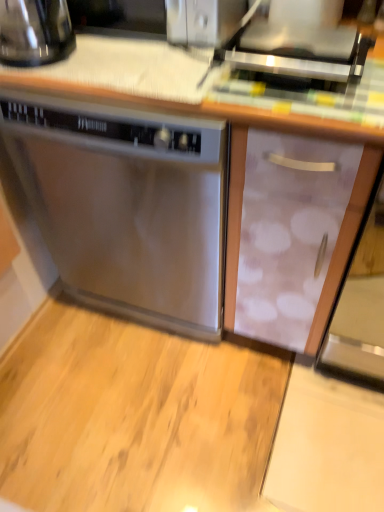
Question: Is shiny black kettle at upper left thinner than stainless steel dishwasher at center?

Choices:
 (A) yes
 (B) no

Answer: (A)

Question: Does shiny black kettle at upper left come behind stainless steel dishwasher at center?

Choices:
 (A) yes
 (B) no

Answer: (A)

Question: From a real-world perspective, is shiny black kettle at upper left below stainless steel dishwasher at center?

Choices:
 (A) no
 (B) yes

Answer: (A)

Question: Does shiny black kettle at upper left have a greater width compared to stainless steel dishwasher at center?

Choices:
 (A) yes
 (B) no

Answer: (B)

Question: Is shiny black kettle at upper left aimed at stainless steel dishwasher at center?

Choices:
 (A) no
 (B) yes

Answer: (A)

Question: From a real-world perspective, is shiny black kettle at upper left on stainless steel dishwasher at center?

Choices:
 (A) no
 (B) yes

Answer: (B)

Question: Considering the relative positions of satin silver toaster at upper center and shiny black kettle at upper left in the image provided, is satin silver toaster at upper center to the right of shiny black kettle at upper left from the viewer's perspective?

Choices:
 (A) no
 (B) yes

Answer: (B)

Question: Is satin silver toaster at upper center wider than shiny black kettle at upper left?

Choices:
 (A) yes
 (B) no

Answer: (A)

Question: Is the depth of satin silver toaster at upper center greater than that of shiny black kettle at upper left?

Choices:
 (A) yes
 (B) no

Answer: (B)

Question: Considering the relative sizes of satin silver toaster at upper center and shiny black kettle at upper left in the image provided, is satin silver toaster at upper center bigger than shiny black kettle at upper left?

Choices:
 (A) yes
 (B) no

Answer: (B)

Question: From a real-world perspective, is satin silver toaster at upper center located higher than shiny black kettle at upper left?

Choices:
 (A) yes
 (B) no

Answer: (B)

Question: Is satin silver toaster at upper center positioned beyond the bounds of shiny black kettle at upper left?

Choices:
 (A) yes
 (B) no

Answer: (A)

Question: Can you confirm if satin silver toaster at upper center is positioned to the right of stainless steel dishwasher at center?

Choices:
 (A) no
 (B) yes

Answer: (B)